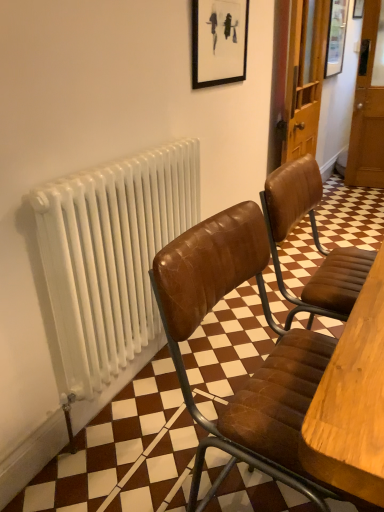
This screenshot has height=512, width=384. Describe the element at coordinates (111, 257) in the screenshot. I see `white metallic radiator at left` at that location.

Where is `white metallic radiator at left`? This screenshot has height=512, width=384. white metallic radiator at left is located at coordinates (111, 257).

What is the approximate width of white metallic radiator at left?

white metallic radiator at left is 4.47 centimeters in width.

The width and height of the screenshot is (384, 512). What are the coordinates of `wooden picture frame at upper right` in the screenshot? It's located at (336, 37).

From the picture: Measure the distance between wooden picture frame at upper right and camera.

The distance of wooden picture frame at upper right from camera is 3.48 meters.

What do you see at coordinates (336, 37) in the screenshot?
I see `wooden picture frame at upper right` at bounding box center [336, 37].

Find the location of a particular element. white metallic radiator at left is located at coordinates coord(111,257).

Considering the relative positions of wooden picture frame at upper right and white metallic radiator at left in the image provided, is wooden picture frame at upper right to the left of white metallic radiator at left from the viewer's perspective?

Incorrect, wooden picture frame at upper right is not on the left side of white metallic radiator at left.

Which is in front, wooden picture frame at upper right or white metallic radiator at left?

Positioned in front is white metallic radiator at left.

Between point (334, 62) and point (77, 295), which one is positioned in front?

The point (77, 295) is closer.

From the image's perspective, is wooden picture frame at upper right positioned above or below white metallic radiator at left?

From the image's perspective, wooden picture frame at upper right appears above white metallic radiator at left.

From a real-world perspective, between wooden picture frame at upper right and white metallic radiator at left, who is vertically higher?

From a 3D spatial view, wooden picture frame at upper right is above.

In the scene shown: Looking at their sizes, would you say wooden picture frame at upper right is wider or thinner than white metallic radiator at left?

wooden picture frame at upper right is wider than white metallic radiator at left.

Which of these two, wooden picture frame at upper right or white metallic radiator at left, stands taller?

With more height is wooden picture frame at upper right.

Does wooden picture frame at upper right have a larger size compared to white metallic radiator at left?

Yes, wooden picture frame at upper right is bigger than white metallic radiator at left.

From the picture: Does wooden picture frame at upper right contain white metallic radiator at left?

No, white metallic radiator at left is not inside wooden picture frame at upper right.

In the scene shown: Is wooden picture frame at upper right next to white metallic radiator at left and touching it?

No, wooden picture frame at upper right is not touching white metallic radiator at left.

Is wooden picture frame at upper right aimed at white metallic radiator at left?

No, wooden picture frame at upper right is not facing towards white metallic radiator at left.

At what (x,y) coordinates should I click in order to perform the action: click on picture frame to the right of white metallic radiator at left. Please return your answer as a coordinate pair (x, y). Looking at the image, I should click on (336, 37).

Considering the relative positions of white metallic radiator at left and wooden picture frame at upper right in the image provided, is white metallic radiator at left to the left of wooden picture frame at upper right from the viewer's perspective?

Yes, white metallic radiator at left is to the left of wooden picture frame at upper right.

Which object is closer to the camera, white metallic radiator at left or wooden picture frame at upper right?

white metallic radiator at left.

Between point (198, 181) and point (342, 52), which one is positioned in front?

Positioned in front is point (198, 181).

From the image's perspective, is white metallic radiator at left above or below wooden picture frame at upper right?

Based on their image positions, white metallic radiator at left is located beneath wooden picture frame at upper right.

From a real-world perspective, is white metallic radiator at left physically above wooden picture frame at upper right?

Incorrect, from a real-world perspective, white metallic radiator at left is lower than wooden picture frame at upper right.

Is white metallic radiator at left wider than wooden picture frame at upper right?

No.

Is white metallic radiator at left taller than wooden picture frame at upper right?

In fact, white metallic radiator at left may be shorter than wooden picture frame at upper right.

Considering the sizes of objects white metallic radiator at left and wooden picture frame at upper right in the image provided, who is bigger, white metallic radiator at left or wooden picture frame at upper right?

With larger size is wooden picture frame at upper right.

Do you think white metallic radiator at left is within wooden picture frame at upper right, or outside of it?

white metallic radiator at left exists outside the volume of wooden picture frame at upper right.

Is white metallic radiator at left next to wooden picture frame at upper right?

No, white metallic radiator at left is not touching wooden picture frame at upper right.

Is white metallic radiator at left facing away from wooden picture frame at upper right?

No, wooden picture frame at upper right is not at the back of white metallic radiator at left.

The width and height of the screenshot is (384, 512). Identify the location of picture frame located above the white metallic radiator at left (from the image's perspective). (336, 37).

Locate an element on the screen. picture frame lying on the right of white metallic radiator at left is located at coordinates (336, 37).

This screenshot has width=384, height=512. Find the location of `picture frame located above the white metallic radiator at left (from a real-world perspective)`. picture frame located above the white metallic radiator at left (from a real-world perspective) is located at coordinates (336, 37).